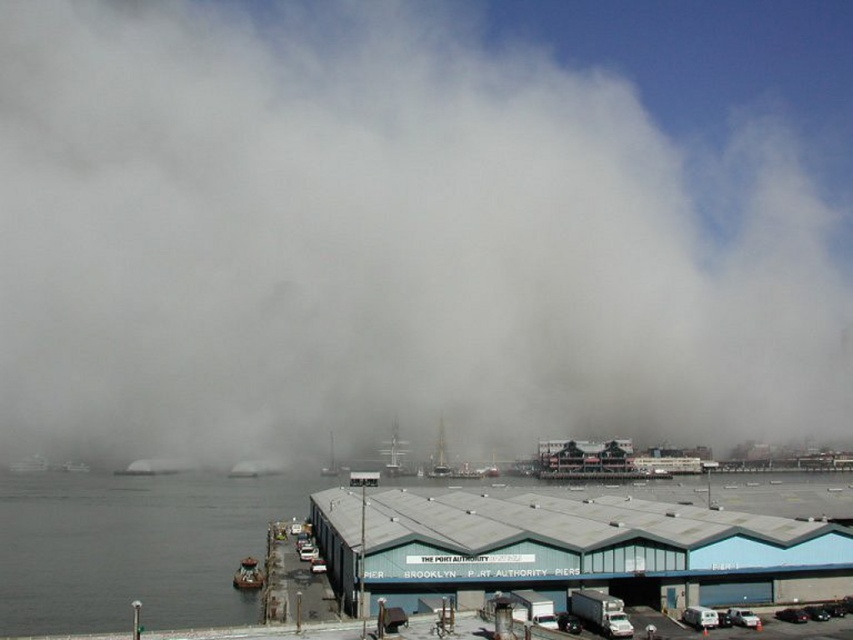
Question: Estimate the real-world distances between objects in this image. Which object is farther from the white wooden sailboat at center?

Choices:
 (A) gray matte water at lower left
 (B) gray metal dock at lower center

Answer: (B)

Question: Considering the relative positions of white fog at center and gray metal dock at lower center in the image provided, where is white fog at center located with respect to gray metal dock at lower center?

Choices:
 (A) left
 (B) right

Answer: (A)

Question: Which point is closer to the camera taking this photo?

Choices:
 (A) (331, 468)
 (B) (234, 573)
 (C) (519, 492)
 (D) (390, 456)

Answer: (B)

Question: Is gray metal dock at lower center smaller than white wooden ship at center?

Choices:
 (A) no
 (B) yes

Answer: (A)

Question: Can you confirm if white fog at center is positioned above gray matte water at lower left?

Choices:
 (A) no
 (B) yes

Answer: (B)

Question: Which object is positioned farthest from the gray metal dock at lower center?

Choices:
 (A) gray matte water at lower left
 (B) metallic gray boat at lower left

Answer: (A)